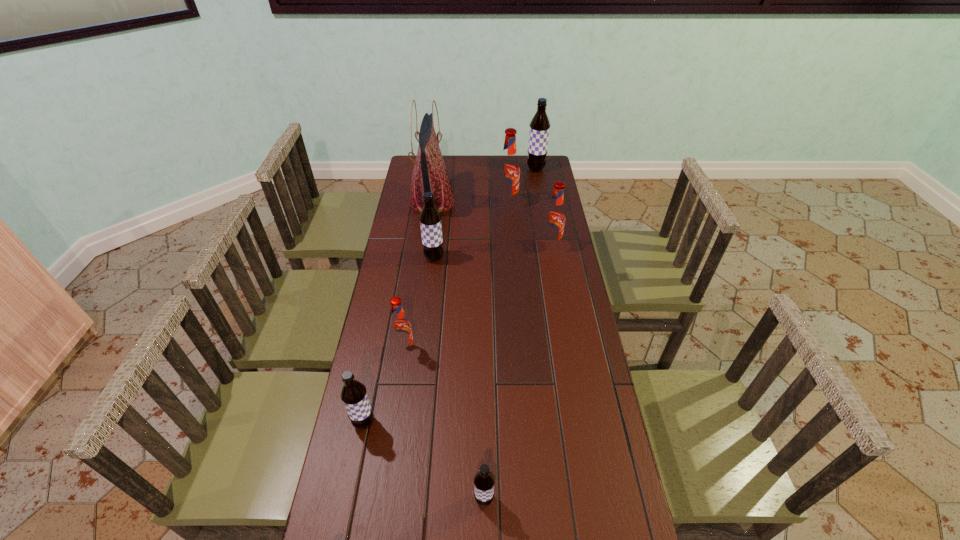
Where is `object that is the closest one to the leftmost red root beer`? object that is the closest one to the leftmost red root beer is located at coordinates (353, 394).

Locate which root beer ranks third in proximity to the nearest root beer. Please provide its 2D coordinates. Your answer should be formatted as a tuple, i.e. [(x, y)], where the tuple contains the x and y coordinates of a point satisfying the conditions above.

[(430, 219)]

Where is `the sixth closest root beer to the sixth nearest root beer`? The image size is (960, 540). the sixth closest root beer to the sixth nearest root beer is located at coordinates (484, 480).

Identify which red root beer is the second closest to the second red root beer from left to right. Please provide its 2D coordinates. Your answer should be formatted as a tuple, i.e. [(x, y)], where the tuple contains the x and y coordinates of a point satisfying the conditions above.

[(400, 327)]

Image resolution: width=960 pixels, height=540 pixels. What are the coordinates of `red root beer that is the third closest to the handbag` in the screenshot? It's located at (400, 327).

Point out which brown root beer is positioned as the second nearest to the tallest object. Please provide its 2D coordinates. Your answer should be formatted as a tuple, i.e. [(x, y)], where the tuple contains the x and y coordinates of a point satisfying the conditions above.

[(539, 130)]

Where is `brown root beer that is the nearest to the second smallest red root beer`? The height and width of the screenshot is (540, 960). brown root beer that is the nearest to the second smallest red root beer is located at coordinates (430, 219).

Identify the location of free space that satisfies the following two spatial constraints: 1. on the back side of the nearest root beer; 2. on the left side of the second farthest red root beer. This screenshot has height=540, width=960. (483, 246).